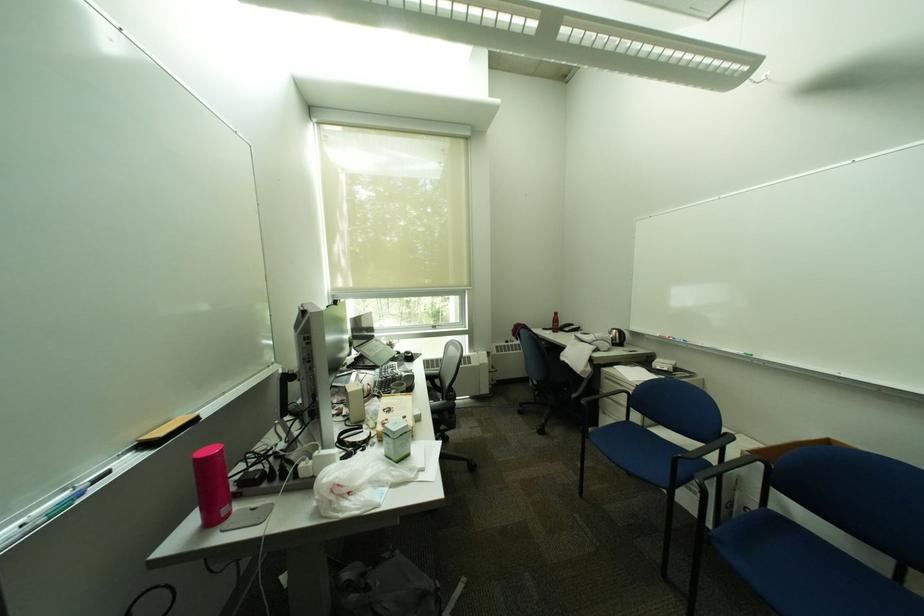
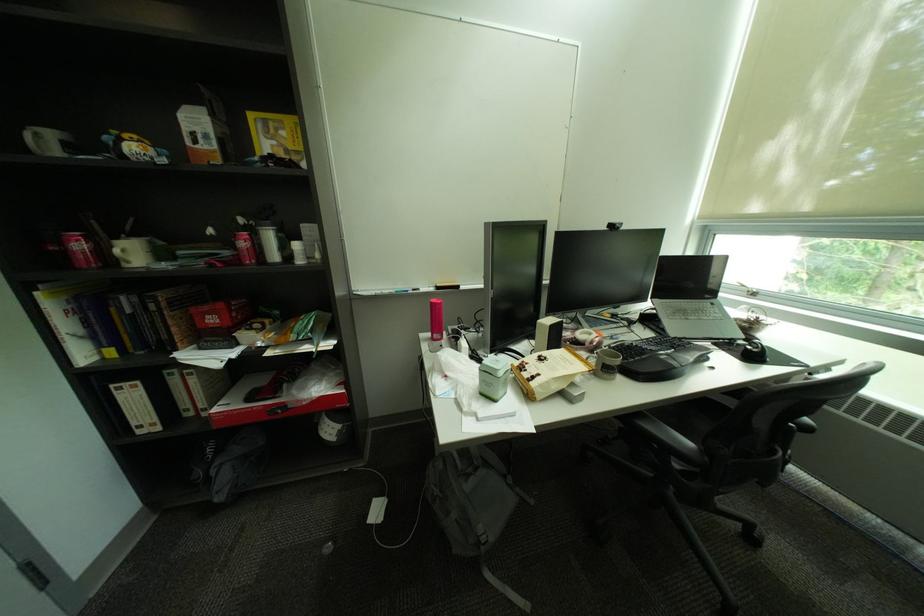
Find the pixel in the second image that matches pixel 172 436 in the first image.

(450, 286)